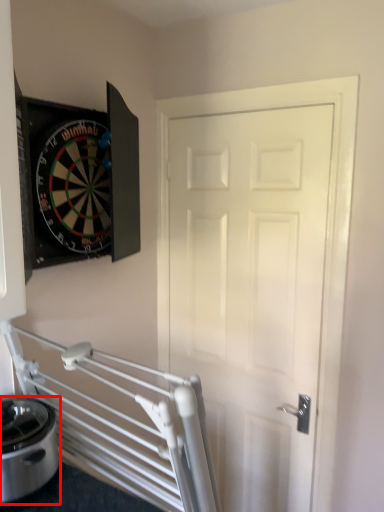
Question: Observing the image, what is the correct spatial positioning of appliance (annotated by the red box) in reference to door?

Choices:
 (A) right
 (B) left

Answer: (B)